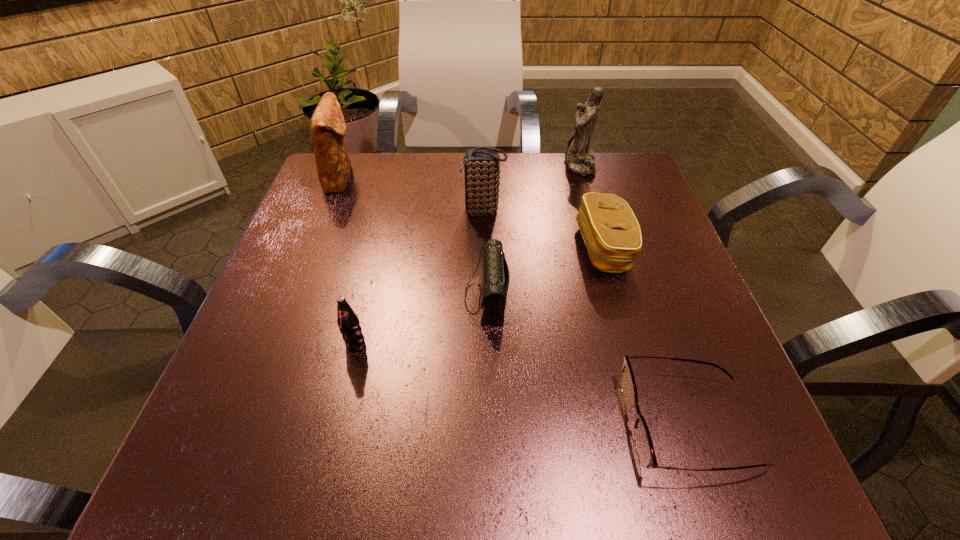
At what (x,y) coordinates should I click in order to perform the action: click on figurine. Please return your answer as a coordinate pair (x, y). This screenshot has height=540, width=960. Looking at the image, I should click on (579, 157).

You are a GUI agent. You are given a task and a screenshot of the screen. Output one action in this format:
    pyautogui.click(x=<x>, y=<y>)
    Task: Click on the farthest clutch bag
    The width and height of the screenshot is (960, 540).
    Given the screenshot: What is the action you would take?
    pyautogui.click(x=328, y=127)

Locate an element on the screen. Image resolution: width=960 pixels, height=540 pixels. the leftmost clutch bag is located at coordinates (328, 127).

Find the location of `the third tallest object`. the third tallest object is located at coordinates (482, 167).

At what (x,y) coordinates should I click in order to perform the action: click on the third farthest object. Please return your answer as a coordinate pair (x, y). This screenshot has height=540, width=960. Looking at the image, I should click on (482, 167).

I want to click on the sixth farthest object, so click(x=349, y=325).

What are the coordinates of `the fourth tallest object` in the screenshot? It's located at (349, 325).

The image size is (960, 540). In order to click on the rightmost clutch bag in this screenshot , I will do [611, 232].

Locate an element on the screen. The height and width of the screenshot is (540, 960). the nearest object is located at coordinates click(x=644, y=446).

Identify the location of the shortest object. Image resolution: width=960 pixels, height=540 pixels. (644, 446).